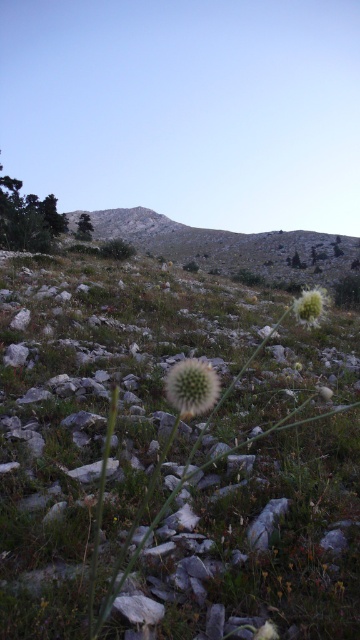
You are a hiker trying to navigate through the rocky terrain. You see a bare rock at upper center and a white fuzzy ball at center. Which object would you need to step around due to its larger size?

The bare rock at upper center might be wider than the white fuzzy ball at center, so you would need to step around the bare rock at upper center.

You are standing in the landscape scene described. You need to place a small marker at the exact center of the image. Is the bare rock at upper center located to the left or right of this central point?

The bare rock at upper center is located at point 0.389 on the x axis. The exact center of the image would be at 0.5. Since 0.389 is less than 0.5, the bare rock at upper center is to the left of the central point.